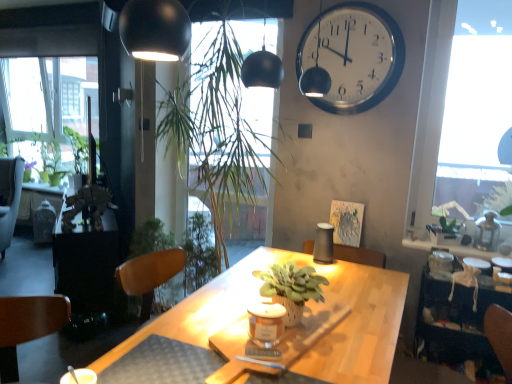
I want to click on free space above wooden table at right, placed as the first table when sorted from front to back (from a real-world perspective), so click(471, 271).